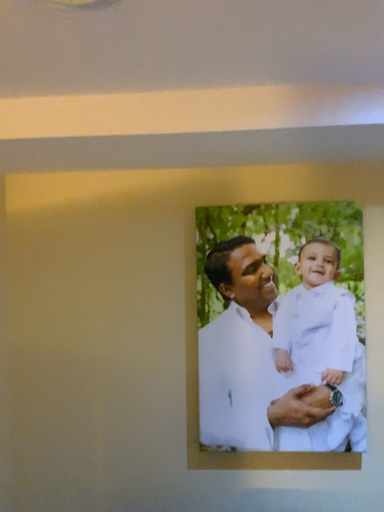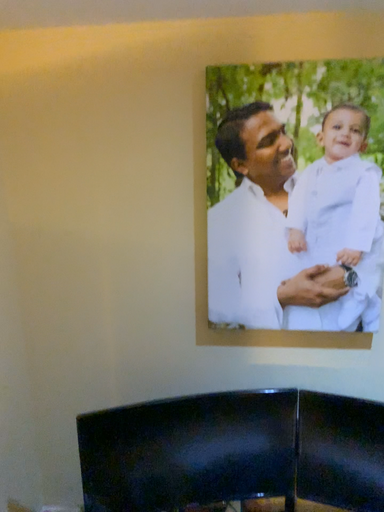
Question: How did the camera likely rotate when shooting the video?

Choices:
 (A) rotated upward
 (B) rotated downward

Answer: (B)